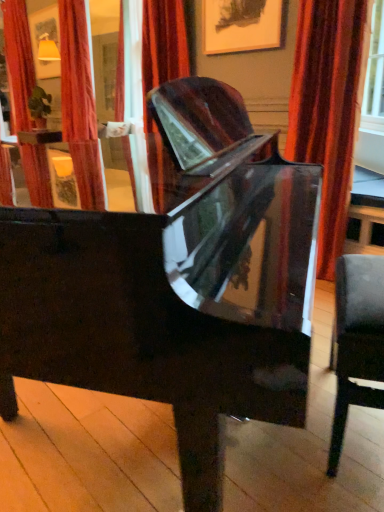
Question: From the image's perspective, is leather-like black chair at right above or below velvet red curtain at upper left, the first curtain viewed from the left?

Choices:
 (A) above
 (B) below

Answer: (B)

Question: Relative to velvet red curtain at upper left, positioned as the 2th curtain in right-to-left order, is leather-like black chair at right in front or behind?

Choices:
 (A) front
 (B) behind

Answer: (A)

Question: Which of these objects is positioned farthest from the velvet-like red curtain at right, which is the first curtain in bottom-to-top order?

Choices:
 (A) leather-like black chair at right
 (B) velvet red curtain at upper left, the first curtain viewed from the left
 (C) glossy black piano at center

Answer: (B)

Question: Which object is positioned closest to the velvet-like red curtain at right, which is the first curtain in bottom-to-top order?

Choices:
 (A) leather-like black chair at right
 (B) glossy black piano at center
 (C) velvet red curtain at upper left, positioned as the 2th curtain in right-to-left order

Answer: (B)